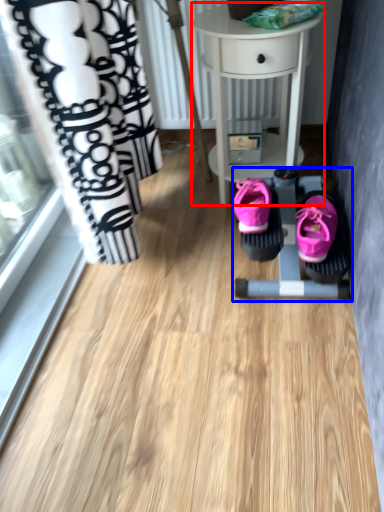
Question: Which object is closer to the camera taking this photo, table (highlighted by a red box) or baby carriage (highlighted by a blue box)?

Choices:
 (A) table
 (B) baby carriage

Answer: (A)